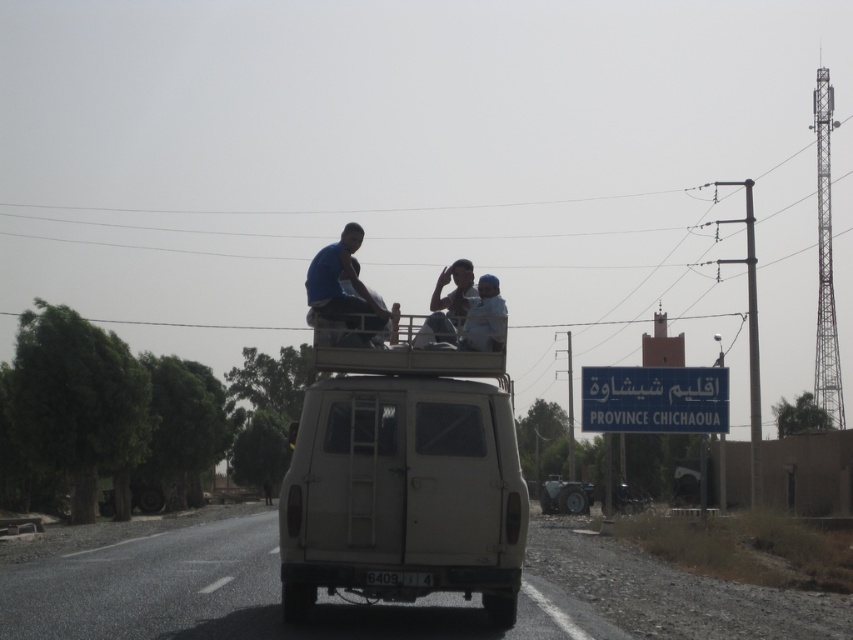
Question: Is blue fabric shirt at center thinner than light blue fabric at center?

Choices:
 (A) no
 (B) yes

Answer: (A)

Question: Can you confirm if metallic rectangular sign at center is smaller than light blue fabric at center?

Choices:
 (A) yes
 (B) no

Answer: (B)

Question: Estimate the real-world distances between objects in this image. Which object is farther from the blue fabric shirt at center?

Choices:
 (A) metallic rectangular sign at center
 (B) light blue fabric at center

Answer: (A)

Question: From the image, what is the correct spatial relationship of metallic rectangular sign at center in relation to light blue fabric at center?

Choices:
 (A) left
 (B) right

Answer: (B)

Question: Which object is closer to the camera taking this photo?

Choices:
 (A) light blue fabric at center
 (B) blue fabric shirt at center
 (C) metallic rectangular sign at center

Answer: (A)

Question: Estimate the real-world distances between objects in this image. Which object is closer to the metallic rectangular sign at center?

Choices:
 (A) light blue fabric at center
 (B) blue fabric shirt at center

Answer: (B)